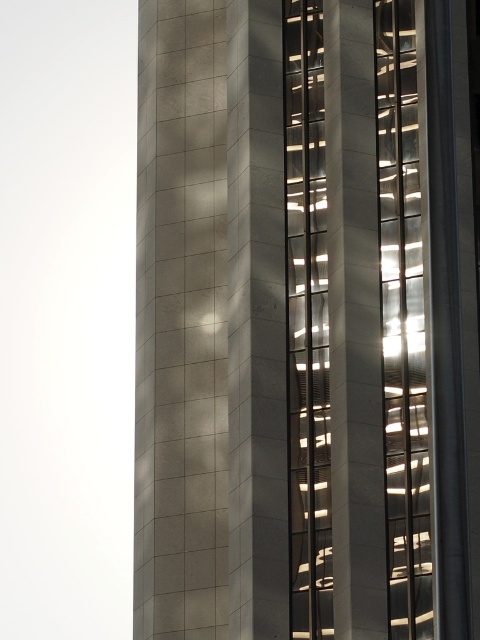
You are standing in front of the modern architectural structure shown in the image. There is a point labeled at coordinates point (307, 321). Which structure does this point belong to?

The point (307, 321) is on the satin concrete tower at center.

You are standing in front of the architectural structure shown in the image. If you were to draw a straight line from your eye level to the exact center of the satin concrete tower at center, what would be the direction of this line relative to the building?

The exact center of the satin concrete tower at center is located at coordinates point (307, 321), so drawing a straight line from your eye level to this point would mean the line is directed towards the center of the building.

In the scene shown: You are an architect reviewing the design of the building. You notice the satin concrete tower at center and the transparent glass elevator at center. Which one is closer to the entrance of the building?

The satin concrete tower at center is closer to the entrance of the building because it is in front of the transparent glass elevator at center.